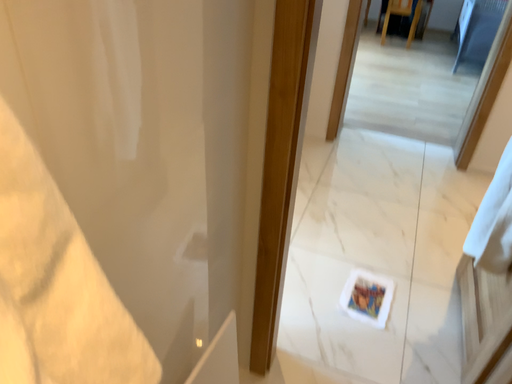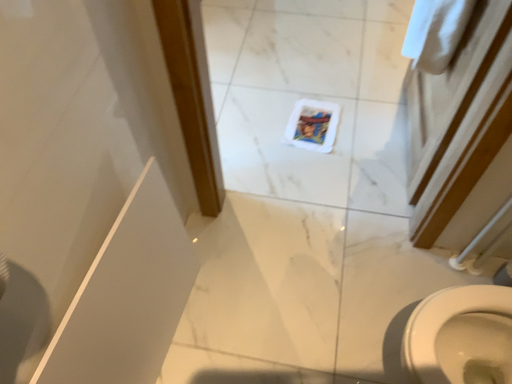
Question: How did the camera likely rotate when shooting the video?

Choices:
 (A) rotated downward
 (B) rotated upward

Answer: (A)